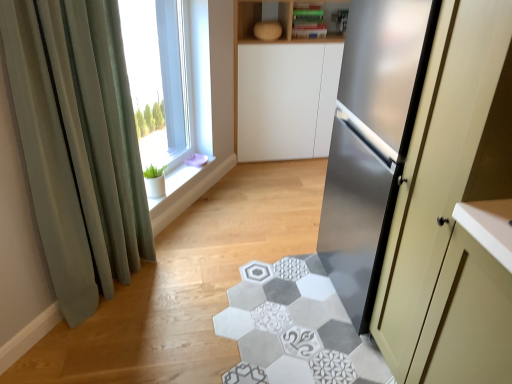
I want to click on vacant area situated to the left side of satin silver refrigerator at right, so click(x=269, y=300).